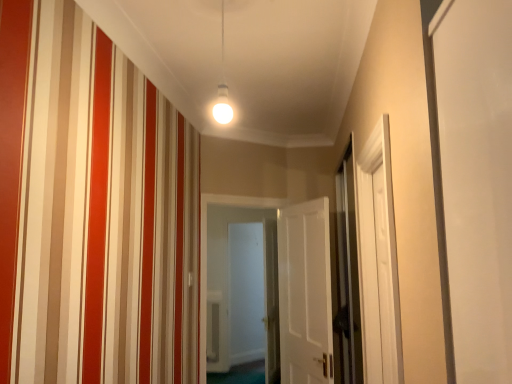
What do you see at coordinates (246, 292) in the screenshot?
I see `white glossy door at center, which is the 1th screen door from back to front` at bounding box center [246, 292].

Locate an element on the screen. This screenshot has width=512, height=384. white matte door at center, marked as the 1th door in a right-to-left arrangement is located at coordinates (305, 293).

Where is `screen door on the right side of white glossy door at center, acting as the first screen door starting from the left`? This screenshot has height=384, width=512. screen door on the right side of white glossy door at center, acting as the first screen door starting from the left is located at coordinates (348, 272).

From a real-world perspective, relative to clear glass screen door at right, the second screen door from the left, is white glossy door at center, which appears as the second screen door when viewed from the front, vertically above or below?

From a real-world perspective, white glossy door at center, which appears as the second screen door when viewed from the front, is physically below clear glass screen door at right, the second screen door from the left.

Which of these two, white glossy door at center, acting as the first screen door starting from the left, or clear glass screen door at right, which is the first screen door from right to left, is bigger?

Bigger between the two is white glossy door at center, acting as the first screen door starting from the left.

Is white glossy door at center, which appears as the second screen door when viewed from the front, positioned with its back to clear glass screen door at right, the second screen door viewed from the back?

That's not correct — white glossy door at center, which appears as the second screen door when viewed from the front, is not looking away from clear glass screen door at right, the second screen door viewed from the back.

Does white matte door at center, marked as the 1th door in a right-to-left arrangement, have a lesser width compared to white wooden door at center, which ranks as the first door in left-to-right order?

Yes.

Is white matte door at center, which is the second door in left-to-right order, smaller than white wooden door at center, which ranks as the first door in left-to-right order?

Indeed, white matte door at center, which is the second door in left-to-right order, has a smaller size compared to white wooden door at center, which ranks as the first door in left-to-right order.

From the image's perspective, which is below, white matte door at center, marked as the 1th door in a right-to-left arrangement, or white wooden door at center, which ranks as the first door in left-to-right order?

From the image's view, white wooden door at center, which ranks as the first door in left-to-right order, is below.

Considering the points (319, 321) and (226, 204), which point is behind, point (319, 321) or point (226, 204)?

Point (226, 204)

Is clear glass screen door at right, the second screen door from the left, shorter than white glossy door at center, which appears as the second screen door when viewed from the front?

Yes, clear glass screen door at right, the second screen door from the left, is shorter than white glossy door at center, which appears as the second screen door when viewed from the front.

Locate an element on the screen. screen door above the white glossy door at center, which is the 1th screen door from back to front (from the image's perspective) is located at coordinates (348, 272).

What's the angular difference between clear glass screen door at right, arranged as the first screen door when viewed from the front, and white glossy door at center, which appears as the second screen door when viewed from the front,'s facing directions?

88.4 degrees separate the facing orientations of clear glass screen door at right, arranged as the first screen door when viewed from the front, and white glossy door at center, which appears as the second screen door when viewed from the front.

Based on the photo, from the image's perspective, is clear glass screen door at right, the second screen door viewed from the back, located above white glossy door at center, acting as the first screen door starting from the left?

Yes, from the image's perspective, clear glass screen door at right, the second screen door viewed from the back, is over white glossy door at center, acting as the first screen door starting from the left.

Is clear glass screen door at right, the second screen door viewed from the back, completely or partially inside white matte door at center, marked as the 1th door in a right-to-left arrangement?

No, white matte door at center, marked as the 1th door in a right-to-left arrangement, does not contain clear glass screen door at right, the second screen door viewed from the back.

Between white matte door at center, which is the second door in left-to-right order, and clear glass screen door at right, which is the first screen door from right to left, which one has smaller width?

With smaller width is clear glass screen door at right, which is the first screen door from right to left.

From a real-world perspective, which is physically below, white matte door at center, which is the second door in left-to-right order, or clear glass screen door at right, arranged as the first screen door when viewed from the front?

From a 3D spatial view, white matte door at center, which is the second door in left-to-right order, is below.

Does white matte door at center, which is the second door in left-to-right order, turn towards clear glass screen door at right, which is the first screen door from right to left?

No, white matte door at center, which is the second door in left-to-right order, is not facing towards clear glass screen door at right, which is the first screen door from right to left.

Considering the sizes of objects white wooden door at center, which ranks as the first door in left-to-right order, and clear glass screen door at right, the second screen door viewed from the back, in the image provided, who is bigger, white wooden door at center, which ranks as the first door in left-to-right order, or clear glass screen door at right, the second screen door viewed from the back,?

white wooden door at center, which ranks as the first door in left-to-right order.

Is white wooden door at center, which ranks as the first door in left-to-right order, positioned with its back to clear glass screen door at right, the second screen door from the left?

No, white wooden door at center, which ranks as the first door in left-to-right order,'s orientation is not away from clear glass screen door at right, the second screen door from the left.

From the image's perspective, count 2nd doors downward from the clear glass screen door at right, arranged as the first screen door when viewed from the front, and point to it. Please provide its 2D coordinates.

[(206, 250)]

From a real-world perspective, is white wooden door at center, the 2th door in the right-to-left sequence, located higher than clear glass screen door at right, which is the first screen door from right to left?

No, from a real-world perspective, white wooden door at center, the 2th door in the right-to-left sequence, is not on top of clear glass screen door at right, which is the first screen door from right to left.

In the scene shown: From the image's perspective, which is below, white wooden door at center, which ranks as the first door in left-to-right order, or white glossy door at center, which is the 1th screen door from back to front?

white glossy door at center, which is the 1th screen door from back to front, is shown below in the image.

What's the angular difference between white wooden door at center, the 2th door in the right-to-left sequence, and white glossy door at center, which appears as the second screen door when viewed from the front,'s facing directions?

They differ by 39.9 degrees in their facing directions.

Is white wooden door at center, the 2th door in the right-to-left sequence, positioned with its back to white glossy door at center, the 2th screen door viewed from the right?

white wooden door at center, the 2th door in the right-to-left sequence, does not have its back to white glossy door at center, the 2th screen door viewed from the right.

Is white glossy door at center, which appears as the second screen door when viewed from the front, further to the viewer compared to white matte door at center, which is the second door in left-to-right order?

That is True.

Between white glossy door at center, acting as the first screen door starting from the left, and white matte door at center, marked as the 1th door in a right-to-left arrangement, which one has more height?

Standing taller between the two is white glossy door at center, acting as the first screen door starting from the left.

Between white glossy door at center, the 2th screen door viewed from the right, and white matte door at center, which is the second door in left-to-right order, which one has larger size?

Bigger between the two is white glossy door at center, the 2th screen door viewed from the right.

From a real-world perspective, does white glossy door at center, the 2th screen door viewed from the right, stand above white matte door at center, marked as the 1th door in a right-to-left arrangement?

No, from a real-world perspective, white glossy door at center, the 2th screen door viewed from the right, is not on top of white matte door at center, marked as the 1th door in a right-to-left arrangement.

Locate an element on the screen. screen door below the clear glass screen door at right, the second screen door from the left (from the image's perspective) is located at coordinates (246, 292).

At what (x,y) coordinates should I click in order to perform the action: click on door that appears behind the white matte door at center, marked as the 1th door in a right-to-left arrangement. Please return your answer as a coordinate pair (x, y). Image resolution: width=512 pixels, height=384 pixels. Looking at the image, I should click on (206, 250).

From the image, which object appears to be nearer to white matte door at center, which is the second door in left-to-right order, clear glass screen door at right, the second screen door from the left, or white glossy door at center, the 2th screen door viewed from the right?

clear glass screen door at right, the second screen door from the left, lies closer to white matte door at center, which is the second door in left-to-right order, than the other object.

When comparing their distances from white wooden door at center, the 2th door in the right-to-left sequence, does clear glass screen door at right, arranged as the first screen door when viewed from the front, or white matte door at center, marked as the 1th door in a right-to-left arrangement, seem closer?

The object closer to white wooden door at center, the 2th door in the right-to-left sequence, is white matte door at center, marked as the 1th door in a right-to-left arrangement.

From the image, which object appears to be nearer to white matte door at center, which is the second door in left-to-right order, white glossy door at center, acting as the first screen door starting from the left, or clear glass screen door at right, which is the first screen door from right to left?

clear glass screen door at right, which is the first screen door from right to left, lies closer to white matte door at center, which is the second door in left-to-right order, than the other object.

Which object lies nearer to the anchor point clear glass screen door at right, the second screen door viewed from the back, white matte door at center, marked as the 1th door in a right-to-left arrangement, or white wooden door at center, the 2th door in the right-to-left sequence?

The object closer to clear glass screen door at right, the second screen door viewed from the back, is white matte door at center, marked as the 1th door in a right-to-left arrangement.

Based on their spatial positions, is white matte door at center, marked as the 1th door in a right-to-left arrangement, or clear glass screen door at right, arranged as the first screen door when viewed from the front, further from white wooden door at center, the 2th door in the right-to-left sequence?

clear glass screen door at right, arranged as the first screen door when viewed from the front.

From the image, which object appears to be nearer to clear glass screen door at right, which is the first screen door from right to left, white wooden door at center, which ranks as the first door in left-to-right order, or white glossy door at center, the 2th screen door viewed from the right?

white wooden door at center, which ranks as the first door in left-to-right order, lies closer to clear glass screen door at right, which is the first screen door from right to left, than the other object.

Consider the image. Based on their spatial positions, is white wooden door at center, which ranks as the first door in left-to-right order, or clear glass screen door at right, the second screen door from the left, closer to white matte door at center, which is the second door in left-to-right order?

Based on the image, clear glass screen door at right, the second screen door from the left, appears to be nearer to white matte door at center, which is the second door in left-to-right order.

Based on their spatial positions, is white glossy door at center, which appears as the second screen door when viewed from the front, or white wooden door at center, the 2th door in the right-to-left sequence, further from clear glass screen door at right, the second screen door viewed from the back?

The object further to clear glass screen door at right, the second screen door viewed from the back, is white glossy door at center, which appears as the second screen door when viewed from the front.

The height and width of the screenshot is (384, 512). I want to click on door between clear glass screen door at right, which is the first screen door from right to left, and white wooden door at center, the 2th door in the right-to-left sequence, along the z-axis, so pos(305,293).

Where is `door between white matte door at center, marked as the 1th door in a right-to-left arrangement, and white glossy door at center, the 2th screen door viewed from the right, in the front-back direction`? door between white matte door at center, marked as the 1th door in a right-to-left arrangement, and white glossy door at center, the 2th screen door viewed from the right, in the front-back direction is located at coordinates (206, 250).